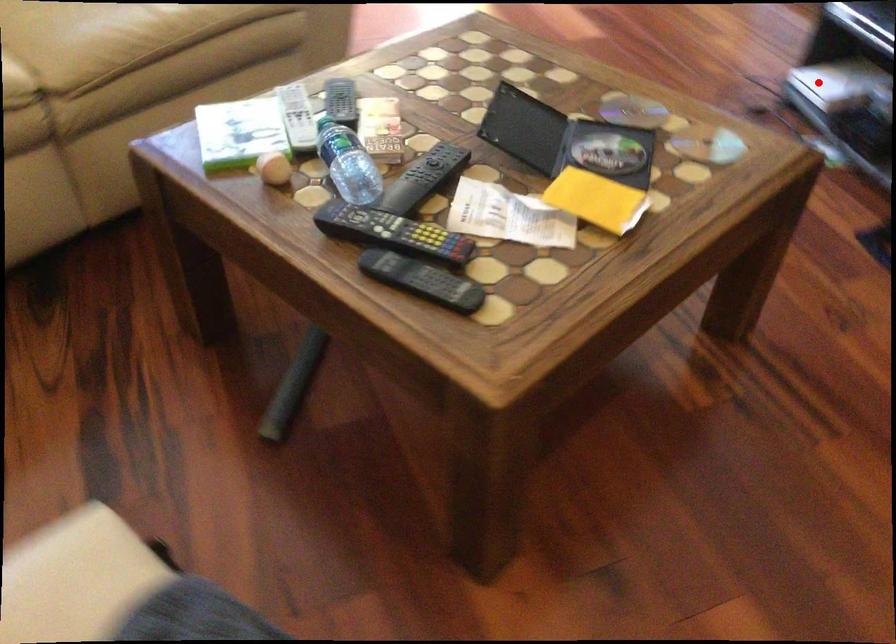
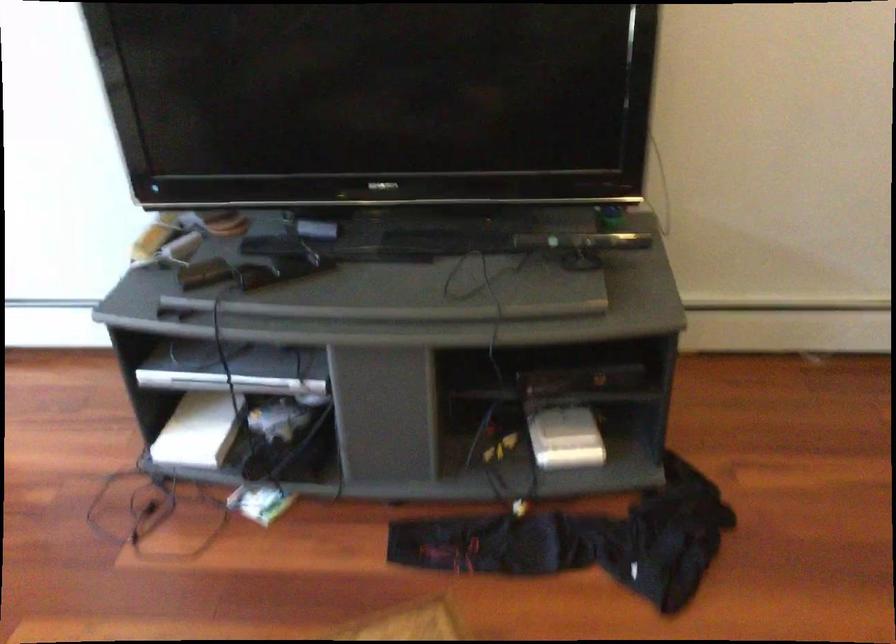
Question: I am providing you with two images of the same scene from different viewpoints. A red point is shown in image1. For the corresponding object point in image2, is it positioned nearer or farther from the camera?

Choices:
 (A) Nearer
 (B) Farther

Answer: (A)